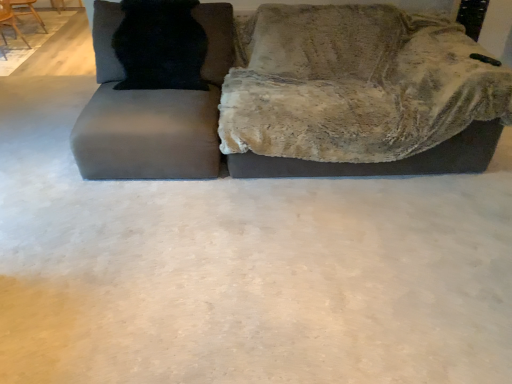
Question: From a real-world perspective, is wooden chair at upper left, the second chair from the back, positioned above or below velvet gray couch at upper center?

Choices:
 (A) below
 (B) above

Answer: (A)

Question: Is point (6, 8) positioned closer to the camera than point (94, 31)?

Choices:
 (A) farther
 (B) closer

Answer: (A)

Question: Estimate the real-world distances between objects in this image. Which object is closer to the wooden chair at upper left, the second chair from the back?

Choices:
 (A) black fur cat at upper left
 (B) wooden chair at upper left, the 2th chair when ordered from front to back
 (C) velvet gray couch at upper center
 (D) matte gray swivel chair at left

Answer: (B)

Question: Estimate the real-world distances between objects in this image. Which object is farther from the wooden chair at upper left, the first chair positioned from the back?

Choices:
 (A) black fur cat at upper left
 (B) velvet gray couch at upper center
 (C) wooden chair at upper left, the second chair from the back
 (D) matte gray swivel chair at left

Answer: (B)